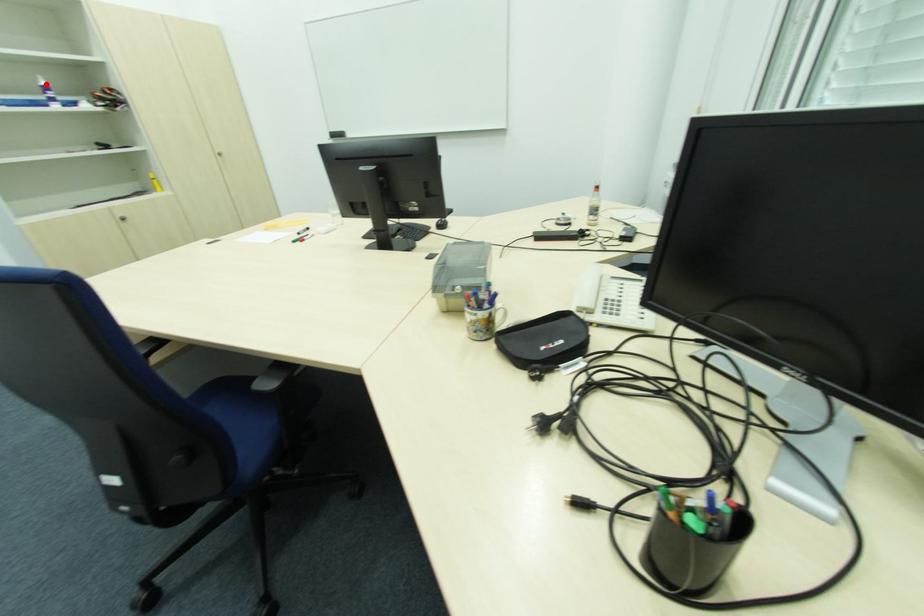
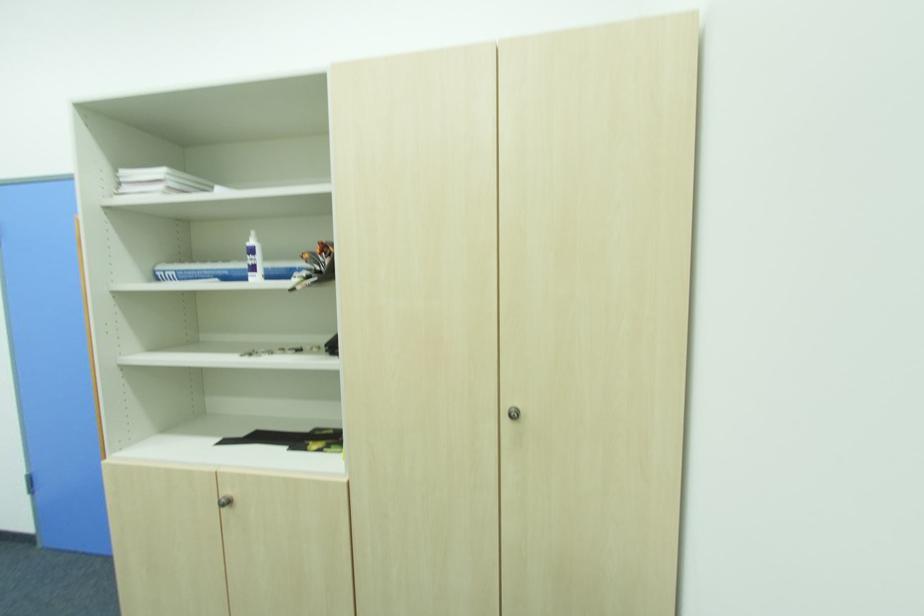
Question: I am providing you with two images of the same scene from different viewpoints. In image1, a red point is highlighted. Considering the same 3D point in image2, which of the following is correct?

Choices:
 (A) It is closer
 (B) It is farther

Answer: (A)